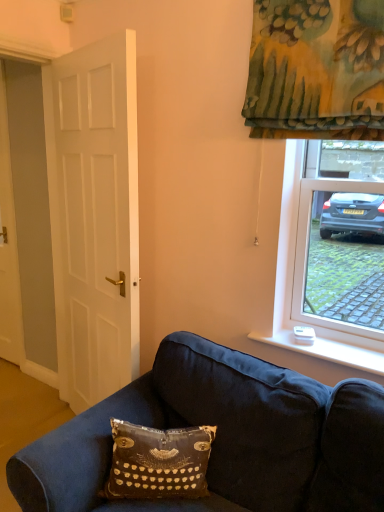
Question: Do you think white matte door at left, the 1th door positioned from the front, is within velvety black pillow with typewriter design at lower center, or outside of it?

Choices:
 (A) inside
 (B) outside

Answer: (B)

Question: From their relative heights in the image, would you say white matte door at left, which appears as the 2th door when viewed from the back, is taller or shorter than velvety black pillow with typewriter design at lower center?

Choices:
 (A) tall
 (B) short

Answer: (A)

Question: Which of these objects is positioned farthest from the white matte door at left, positioned as the first door in right-to-left order?

Choices:
 (A) white plastic remote control at lower right
 (B) velvety black pillow with typewriter design at lower center
 (C) white wood door at left, the first door when ordered from left to right

Answer: (A)

Question: Which of these objects is positioned closest to the white matte door at left, which appears as the 2th door when viewed from the back?

Choices:
 (A) velvety black pillow with typewriter design at lower center
 (B) white plastic remote control at lower right
 (C) white wood door at left, marked as the 2th door in a right-to-left arrangement

Answer: (C)